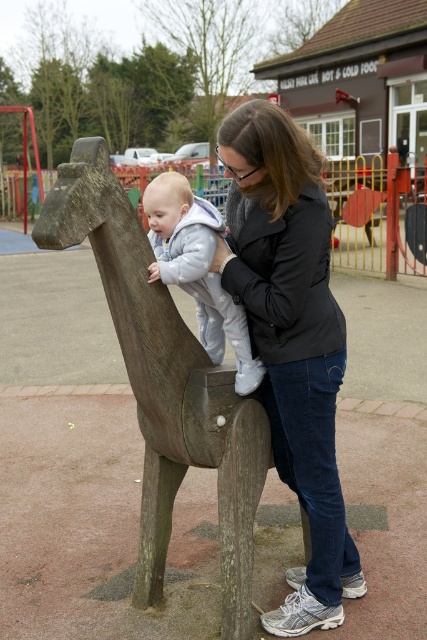
Does matte black jacket at center come in front of light gray fleece onesie at center?

Yes, matte black jacket at center is in front of light gray fleece onesie at center.

Who is more distant from viewer, (292, 164) or (190, 246)?

Positioned behind is point (190, 246).

The image size is (427, 640). Identify the location of matte black jacket at center. (290, 340).